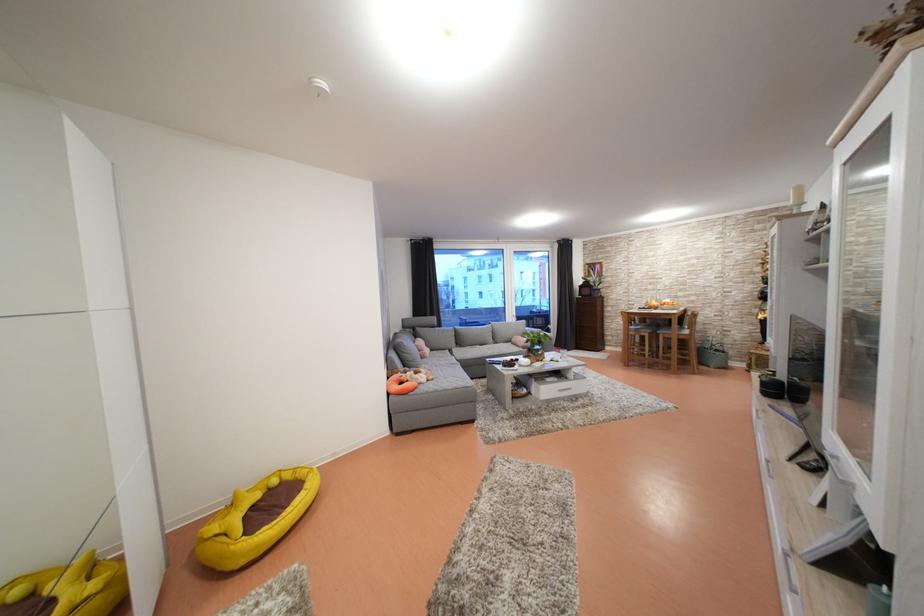
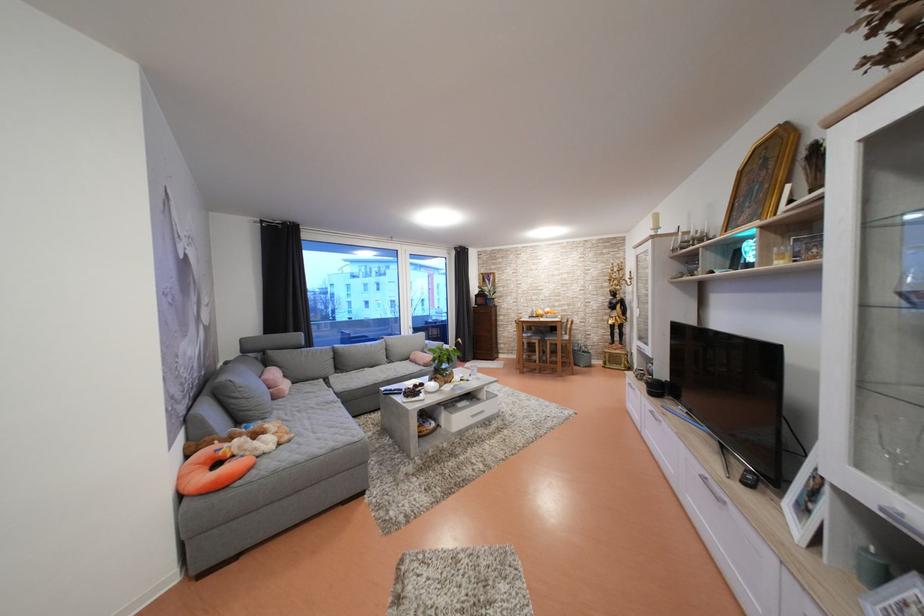
The point at (651,328) is marked in the first image. Where is the corresponding point in the second image?

(538, 334)